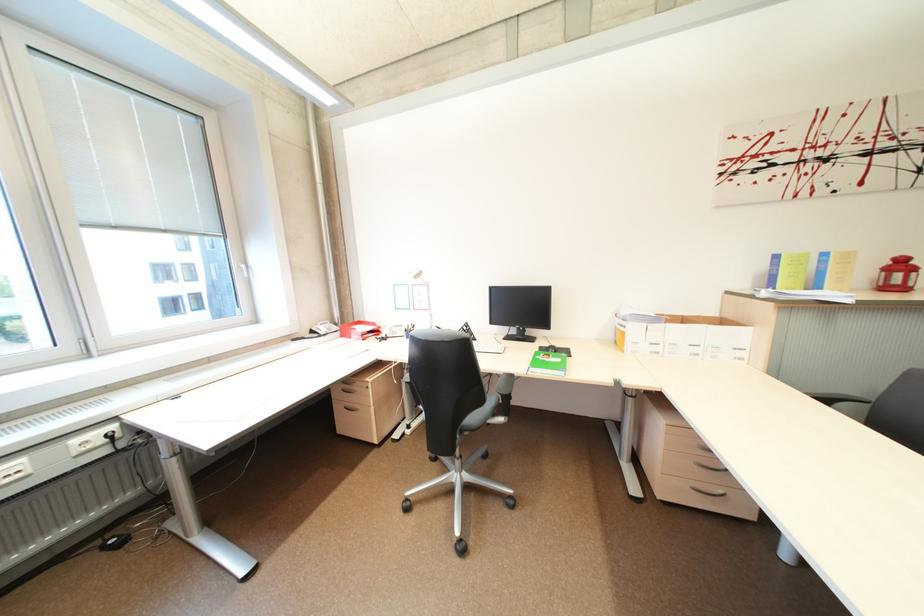
Identify the location of telephone handset. The height and width of the screenshot is (616, 924). (321, 330).